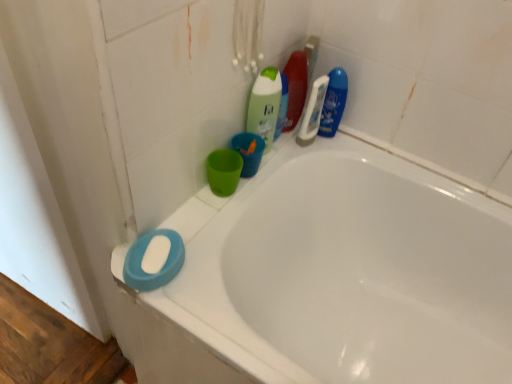
Question: Can we say white glossy bathtub at lower left lies outside blue glossy bottle at upper right, the 4th cleaning product from the left?

Choices:
 (A) yes
 (B) no

Answer: (A)

Question: Is white glossy bathtub at lower left closer to the viewer compared to blue glossy bottle at upper right, the 4th cleaning product from the left?

Choices:
 (A) no
 (B) yes

Answer: (B)

Question: Is white glossy bathtub at lower left at the right side of blue glossy bottle at upper right, which is the 1th cleaning product from right to left?

Choices:
 (A) yes
 (B) no

Answer: (A)

Question: Could you tell me if white glossy bathtub at lower left is facing blue glossy bottle at upper right, the 4th cleaning product from the left?

Choices:
 (A) no
 (B) yes

Answer: (A)

Question: Are white glossy bathtub at lower left and blue glossy bottle at upper right, the 4th cleaning product from the left, making contact?

Choices:
 (A) no
 (B) yes

Answer: (A)

Question: Is white plastic toothbrush at upper center, the third cleaning product when ordered from left to right, bigger or smaller than blue glossy bottle at upper right, which is the 1th cleaning product from right to left?

Choices:
 (A) small
 (B) big

Answer: (A)

Question: Looking at their shapes, would you say white plastic toothbrush at upper center, the third cleaning product when ordered from left to right, is wider or thinner than blue glossy bottle at upper right, which is the 1th cleaning product from right to left?

Choices:
 (A) thin
 (B) wide

Answer: (A)

Question: Considering their positions, is white plastic toothbrush at upper center, the third cleaning product when ordered from left to right, located in front of or behind blue glossy bottle at upper right, which is the 1th cleaning product from right to left?

Choices:
 (A) behind
 (B) front

Answer: (B)

Question: Would you say white plastic toothbrush at upper center, the second cleaning product when ordered from right to left, is to the left or to the right of blue glossy bottle at upper right, the 4th cleaning product from the left, in the picture?

Choices:
 (A) right
 (B) left

Answer: (B)

Question: From the image's perspective, is white matte soap at lower left located above or below blue glossy bottle at upper right, the 4th cleaning product from the left?

Choices:
 (A) above
 (B) below

Answer: (B)

Question: Considering the positions of white matte soap at lower left and blue glossy bottle at upper right, which is the 1th cleaning product from right to left, in the image, is white matte soap at lower left taller or shorter than blue glossy bottle at upper right, which is the 1th cleaning product from right to left,?

Choices:
 (A) short
 (B) tall

Answer: (A)

Question: Does point (151, 258) appear closer or farther from the camera than point (340, 94)?

Choices:
 (A) closer
 (B) farther

Answer: (A)

Question: Choose the correct answer: Is white matte soap at lower left inside blue glossy bottle at upper right, the 4th cleaning product from the left, or outside it?

Choices:
 (A) outside
 (B) inside

Answer: (A)

Question: Considering their positions, is white matte soap at lower left located in front of or behind green matte bottle at upper center, the first cleaning product positioned from the left?

Choices:
 (A) behind
 (B) front

Answer: (B)

Question: Visually, is white matte soap at lower left positioned to the left or to the right of green matte bottle at upper center, the fourth cleaning product when ordered from right to left?

Choices:
 (A) left
 (B) right

Answer: (A)